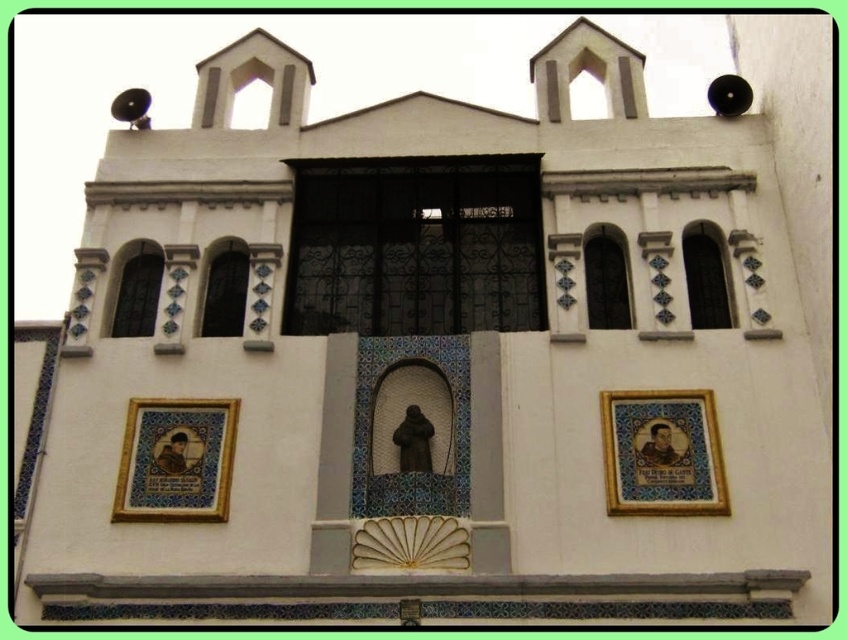
You are standing in front of the building and notice two points marked on the facade. The first point is at coordinates point (356, 202) and the second is at point (720, 296). Which point is closer to you?

Point (720, 296) is closer to you because it is in front of point (356, 202).